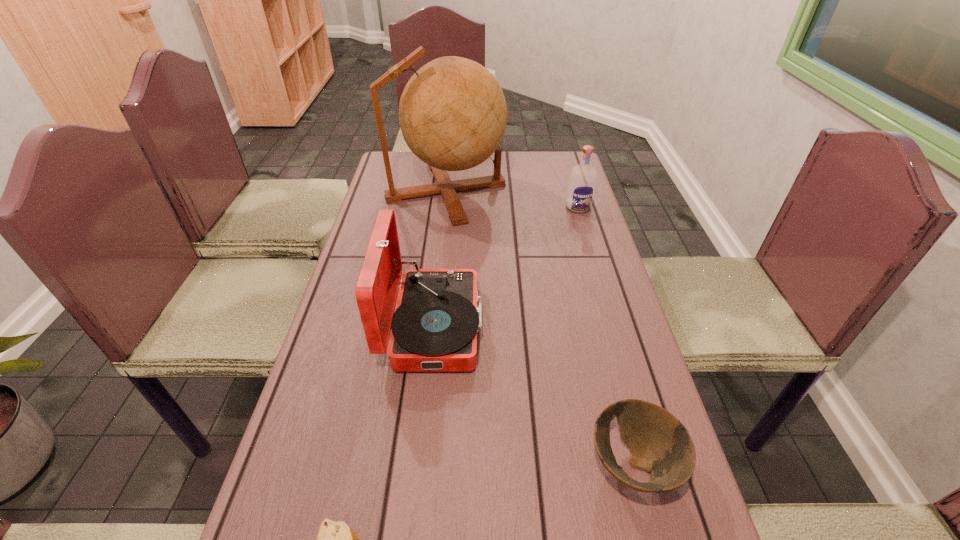
Identify the location of globe. (453, 114).

This screenshot has width=960, height=540. In order to click on the third farthest object in this screenshot , I will do `click(434, 328)`.

You are a GUI agent. You are given a task and a screenshot of the screen. Output one action in this format:
    pyautogui.click(x=<x>, y=<y>)
    Task: Click on the fourth shortest object
    The height and width of the screenshot is (540, 960).
    Given the screenshot: What is the action you would take?
    pyautogui.click(x=434, y=328)

Where is `the third tallest object`? Image resolution: width=960 pixels, height=540 pixels. the third tallest object is located at coordinates (582, 181).

Locate an element on the screen. the second shortest object is located at coordinates (660, 444).

Locate an element on the screen. bowl is located at coordinates (660, 444).

This screenshot has width=960, height=540. Identify the location of blank space located 0.160m on the surface of the tallest object. (552, 192).

Locate an element on the screen. vacant region located 0.150m on the front-facing side of the phonograph_record is located at coordinates (543, 326).

Locate an element on the screen. The image size is (960, 540). free space located 0.280m on the label of the third tallest object is located at coordinates (597, 271).

Where is `vacant space positioned on the left of the fourth farthest object`? This screenshot has width=960, height=540. vacant space positioned on the left of the fourth farthest object is located at coordinates (443, 465).